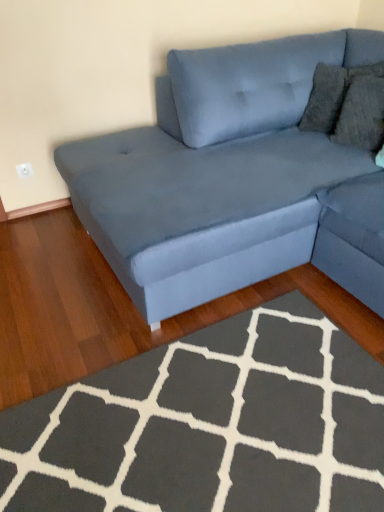
Question: Should I look upward or downward to see velvet blue couch at upper right?

Choices:
 (A) down
 (B) up

Answer: (B)

Question: Should I look upward or downward to see dark gray plush rug at lower center?

Choices:
 (A) down
 (B) up

Answer: (A)

Question: From the image's perspective, would you say dark gray plush rug at lower center is positioned over velvet blue couch at upper right?

Choices:
 (A) yes
 (B) no

Answer: (B)

Question: Is dark gray plush rug at lower center far from velvet blue couch at upper right?

Choices:
 (A) no
 (B) yes

Answer: (A)

Question: Would you say velvet blue couch at upper right is part of dark gray plush rug at lower center's contents?

Choices:
 (A) no
 (B) yes

Answer: (A)

Question: From the image's perspective, is dark gray plush rug at lower center below velvet blue couch at upper right?

Choices:
 (A) no
 (B) yes

Answer: (B)

Question: From a real-world perspective, is dark gray plush rug at lower center over velvet blue couch at upper right?

Choices:
 (A) no
 (B) yes

Answer: (A)

Question: Does dark gray plush rug at lower center lie in front of velvet blue couch at upper right?

Choices:
 (A) no
 (B) yes

Answer: (B)

Question: From a real-world perspective, is velvet blue couch at upper right over dark gray plush rug at lower center?

Choices:
 (A) yes
 (B) no

Answer: (A)

Question: Does velvet blue couch at upper right have a greater width compared to dark gray plush rug at lower center?

Choices:
 (A) yes
 (B) no

Answer: (A)

Question: Is velvet blue couch at upper right facing away from dark gray plush rug at lower center?

Choices:
 (A) yes
 (B) no

Answer: (B)

Question: From the image's perspective, is velvet blue couch at upper right located beneath dark gray plush rug at lower center?

Choices:
 (A) no
 (B) yes

Answer: (A)

Question: Can you confirm if velvet blue couch at upper right is shorter than dark gray plush rug at lower center?

Choices:
 (A) yes
 (B) no

Answer: (B)

Question: Is velvet blue couch at upper right at the right side of dark gray plush rug at lower center?

Choices:
 (A) no
 (B) yes

Answer: (B)

Question: Based on their positions, is dark gray plush rug at lower center located to the left or right of velvet blue couch at upper right?

Choices:
 (A) right
 (B) left

Answer: (B)